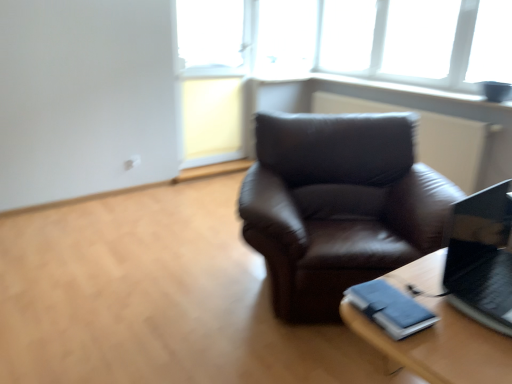
Question: Would you say shiny black laptop at right contains transparent glass window at upper center?

Choices:
 (A) yes
 (B) no

Answer: (B)

Question: Is shiny black laptop at right closer to camera compared to transparent glass window at upper center?

Choices:
 (A) no
 (B) yes

Answer: (B)

Question: Does shiny black laptop at right have a smaller size compared to transparent glass window at upper center?

Choices:
 (A) no
 (B) yes

Answer: (B)

Question: From the image's perspective, is shiny black laptop at right over transparent glass window at upper center?

Choices:
 (A) yes
 (B) no

Answer: (B)

Question: Is the position of shiny black laptop at right more distant than that of transparent glass window at upper center?

Choices:
 (A) yes
 (B) no

Answer: (B)

Question: From the image's perspective, is shiny black laptop at right located beneath transparent glass window at upper center?

Choices:
 (A) yes
 (B) no

Answer: (A)

Question: Can you confirm if transparent glass window at upper center is taller than shiny black laptop at right?

Choices:
 (A) yes
 (B) no

Answer: (A)

Question: Is transparent glass window at upper center positioned behind shiny black laptop at right?

Choices:
 (A) yes
 (B) no

Answer: (A)

Question: Considering the relative sizes of transparent glass window at upper center and shiny black laptop at right in the image provided, is transparent glass window at upper center smaller than shiny black laptop at right?

Choices:
 (A) yes
 (B) no

Answer: (B)

Question: Is transparent glass window at upper center to the left of shiny black laptop at right from the viewer's perspective?

Choices:
 (A) yes
 (B) no

Answer: (B)

Question: Does transparent glass window at upper center have a lesser height compared to shiny black laptop at right?

Choices:
 (A) no
 (B) yes

Answer: (A)

Question: Is there a large distance between transparent glass window at upper center and shiny black laptop at right?

Choices:
 (A) no
 (B) yes

Answer: (B)

Question: Does transparent glass window at upper center have a greater width compared to wooden table at lower right?

Choices:
 (A) yes
 (B) no

Answer: (B)